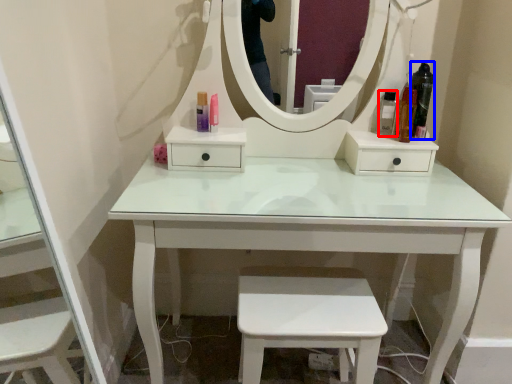
Question: Which point is further to the camera, toiletry (highlighted by a red box) or toiletry (highlighted by a blue box)?

Choices:
 (A) toiletry
 (B) toiletry

Answer: (A)